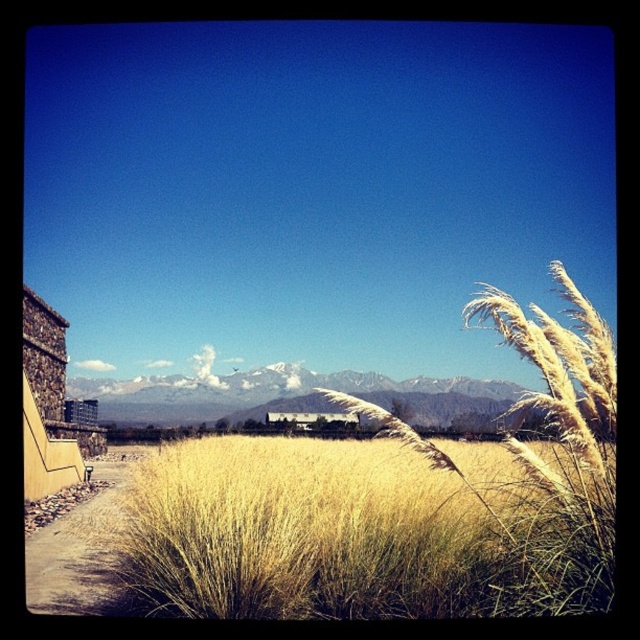
What are the coordinates of `yellow grass at center` in the screenshot? It's located at (349, 534).

Does point (314, 570) come in front of point (106, 476)?

Yes, point (314, 570) is in front of point (106, 476).

Which is behind, point (192, 566) or point (99, 499)?

Point (99, 499)

Identify the location of yellow grass at center. (349, 534).